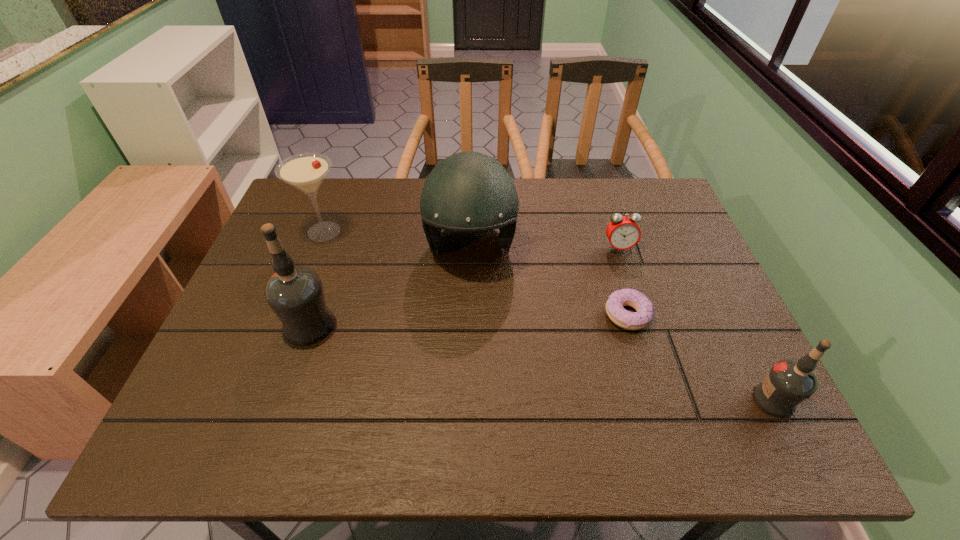
Image resolution: width=960 pixels, height=540 pixels. Identify the location of object at the near edge. pyautogui.click(x=788, y=383).

In order to click on vodka at the left edge in this screenshot , I will do `click(295, 294)`.

In order to click on martini that is at the left edge in this screenshot , I will do `click(306, 171)`.

You are a GUI agent. You are given a task and a screenshot of the screen. Output one action in this format:
    pyautogui.click(x=<x>, y=<y>)
    Task: Click on the object that is at the right edge
    The width and height of the screenshot is (960, 540).
    Given the screenshot: What is the action you would take?
    pyautogui.click(x=788, y=383)

At what (x,y) coordinates should I click in order to perform the action: click on object at the far left corner. Please return your answer as a coordinate pair (x, y). Looking at the image, I should click on (306, 171).

At what (x,y) coordinates should I click in order to perform the action: click on object located in the near right corner section of the desktop. Please return your answer as a coordinate pair (x, y). The image size is (960, 540). Looking at the image, I should click on pos(788,383).

Where is `vacant point at the far edge`? This screenshot has height=540, width=960. vacant point at the far edge is located at coordinates (592, 203).

At what (x,y) coordinates should I click in order to perform the action: click on vacant space at the near edge of the desktop. Please return your answer as a coordinate pair (x, y). This screenshot has width=960, height=540. Looking at the image, I should click on (317, 406).

The height and width of the screenshot is (540, 960). Find the location of `vacant space at the right edge`. vacant space at the right edge is located at coordinates (696, 265).

This screenshot has height=540, width=960. Find the location of `vacant space at the far right corner`. vacant space at the far right corner is located at coordinates (642, 211).